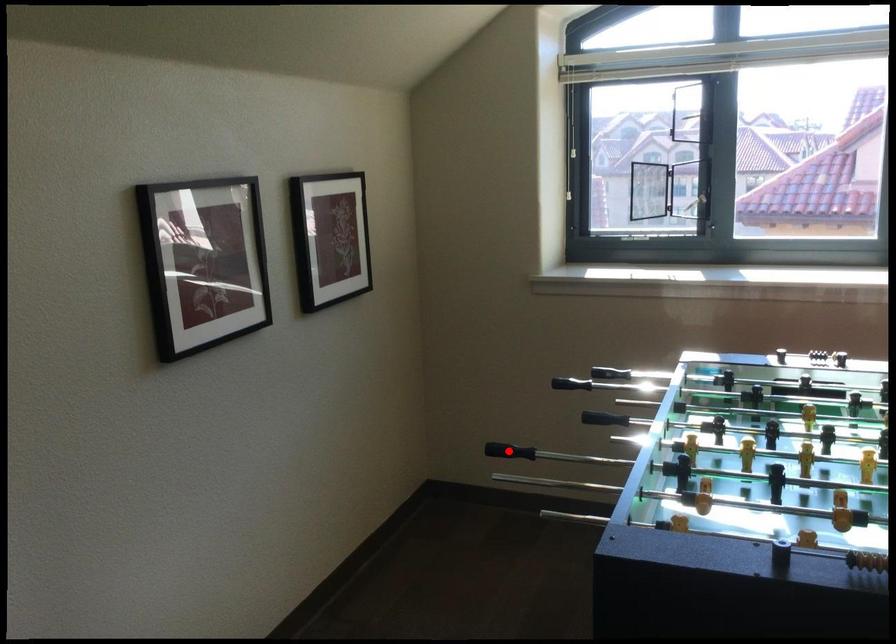
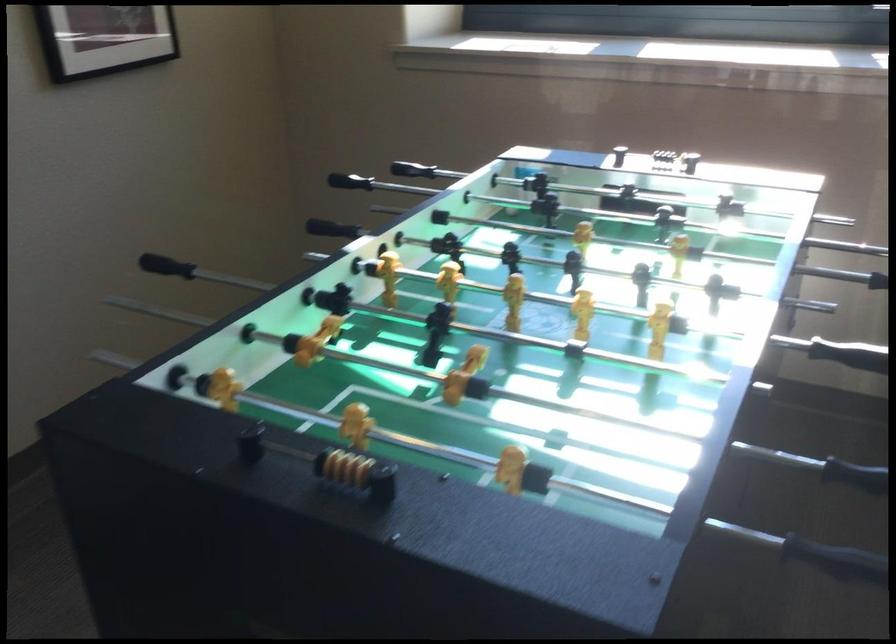
Question: I am providing you with two images of the same scene from different viewpoints. A red point is marked on the first image. Is the red point's position out of view in image 2?

Choices:
 (A) Yes
 (B) No

Answer: (A)